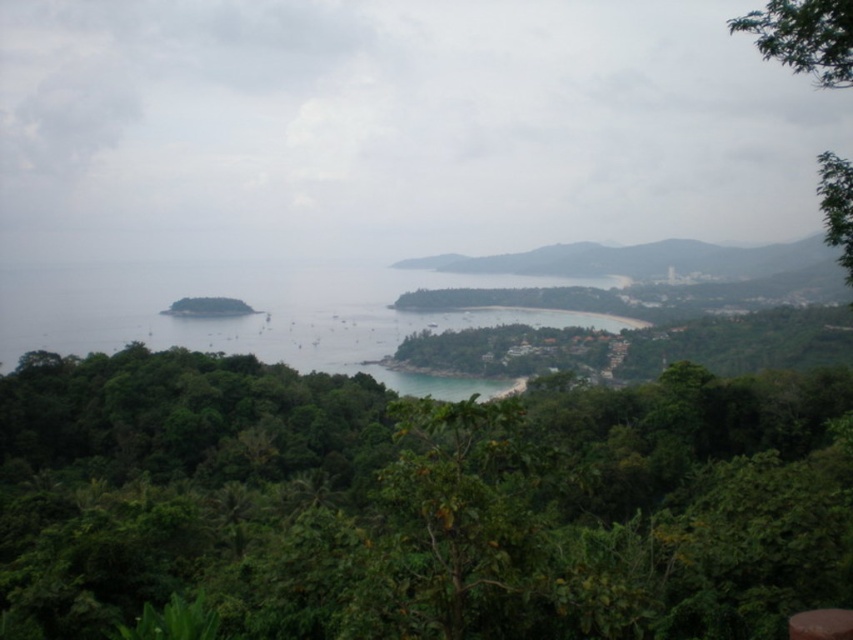
You are standing on the elevated vantage point looking at the scenic coastal view. There is a point marked at coordinates [418,502]. What object is located at that point?

The point at coordinates [418,502] indicates a green leafy tree at center.

You are a hiker standing on the green leafy hillside at center and want to reach the green leafy tree at upper right. Which direction should you move to get closer to the tree?

The green leafy hillside at center is below the green leafy tree at upper right, so you should move upward to reach the tree.